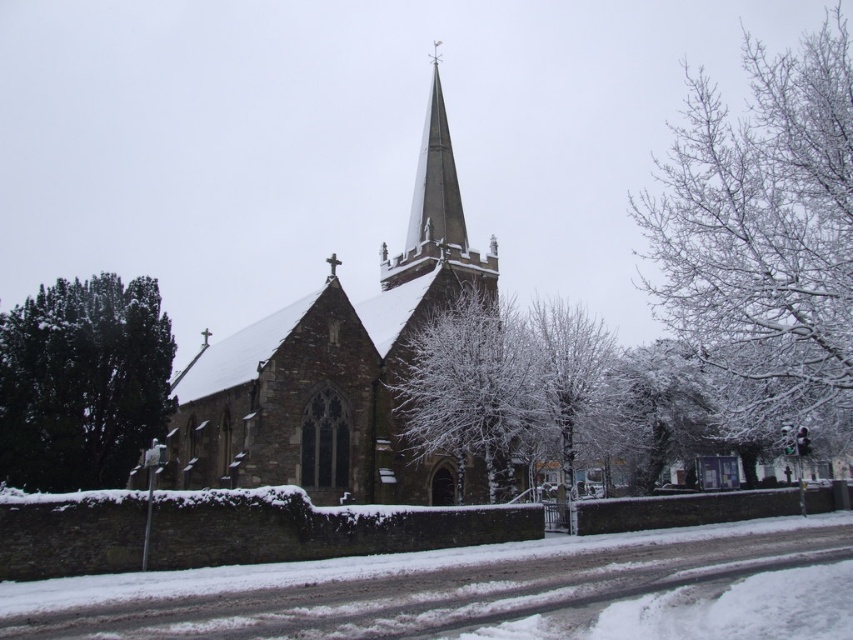
Is white frosty tree at center positioned before smooth gray steeple at center?

That is True.

Between white frosty tree at center and smooth gray steeple at center, which one has more height?

smooth gray steeple at center is taller.

Does point (508, 358) come farther from viewer compared to point (407, 228)?

That is False.

Find the location of a particular element. The height and width of the screenshot is (640, 853). white frosty tree at center is located at coordinates (469, 390).

This screenshot has height=640, width=853. I want to click on green textured tree at left, so click(82, 381).

Is green textured tree at left closer to the viewer compared to smooth gray steeple at center?

That is True.

Who is more distant from viewer, [109,467] or [422,173]?

The point [422,173] is more distant.

This screenshot has width=853, height=640. Identify the location of green textured tree at left. (82, 381).

Does green textured tree at left appear over white snow-covered tree at center?

Yes.

The height and width of the screenshot is (640, 853). What are the coordinates of `green textured tree at left` in the screenshot? It's located at (82, 381).

What are the coordinates of `green textured tree at left` in the screenshot? It's located at (82, 381).